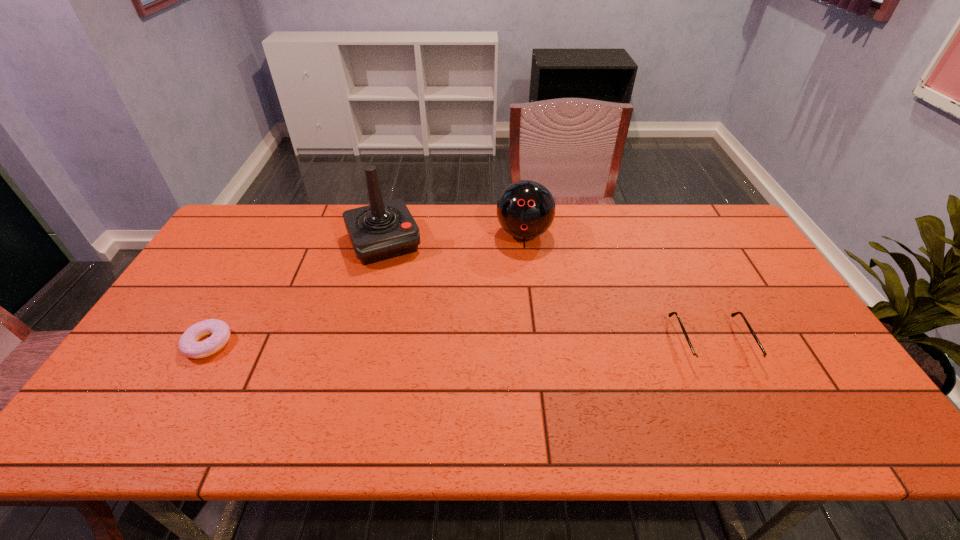
Find the location of a particular element. The image size is (960, 540). vacant area between the second shortest object and the leftmost object is located at coordinates (460, 343).

The width and height of the screenshot is (960, 540). I want to click on empty space between the second object from right to left and the leftmost object, so click(x=366, y=288).

The width and height of the screenshot is (960, 540). I want to click on empty space between the rightmost object and the tallest object, so click(547, 293).

This screenshot has height=540, width=960. Find the location of `the third closest object to the leftmost object`. the third closest object to the leftmost object is located at coordinates (704, 361).

Locate an element on the screen. Image resolution: width=960 pixels, height=540 pixels. the closest object to the rightmost object is located at coordinates pyautogui.click(x=526, y=209).

What are the coordinates of `free point that satisfies the following two spatial constraints: 1. on the back side of the third shortest object; 2. on the left side of the second object from left to right` in the screenshot? It's located at [x=386, y=233].